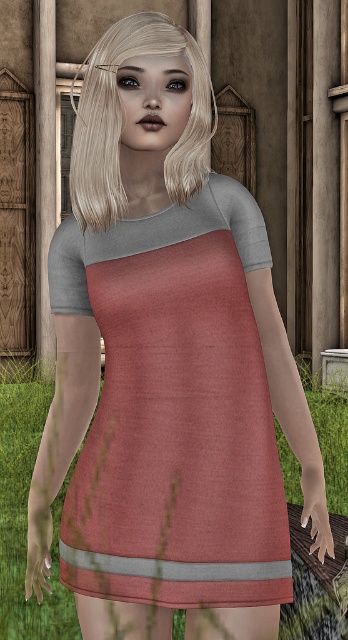
Question: Can you confirm if matte pink fabric dress at center is thinner than matte gray fabric at center?

Choices:
 (A) yes
 (B) no

Answer: (A)

Question: Which of the following is the closest to the observer?

Choices:
 (A) matte pink fabric dress at center
 (B) matte gray fabric at center

Answer: (A)

Question: Based on their relative distances, which object is nearer to the green grass at lower center?

Choices:
 (A) matte pink fabric dress at center
 (B) blonde hair at upper center
 (C) matte gray fabric at center

Answer: (A)

Question: Which of the following is the farthest from the observer?

Choices:
 (A) (109, 68)
 (B) (76, 266)
 (C) (10, 636)
 (D) (178, 490)

Answer: (C)

Question: Is green grass at lower center smaller than blonde hair at upper center?

Choices:
 (A) no
 (B) yes

Answer: (B)

Question: From the image, what is the correct spatial relationship of matte pink fabric dress at center in relation to green grass at lower center?

Choices:
 (A) below
 (B) above

Answer: (B)